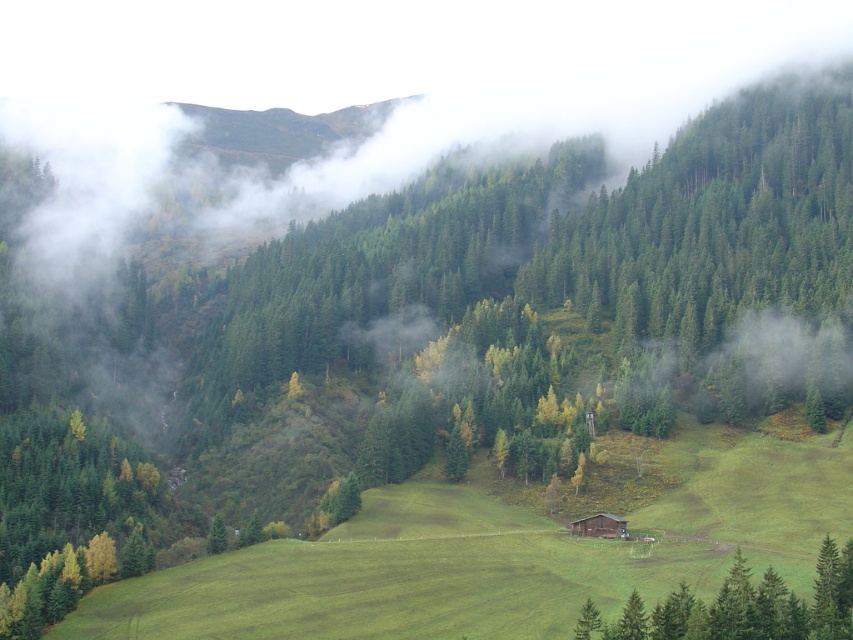
Question: Does green matte tree at lower right appear on the right side of brown wooden cabin at center?

Choices:
 (A) yes
 (B) no

Answer: (A)

Question: Which object appears closest to the camera in this image?

Choices:
 (A) green matte tree at lower right
 (B) brown wooden cabin at center

Answer: (A)

Question: Considering the relative positions of green matte tree at lower right and brown wooden cabin at center in the image provided, where is green matte tree at lower right located with respect to brown wooden cabin at center?

Choices:
 (A) below
 (B) above

Answer: (B)

Question: Among these points, which one is nearest to the camera?

Choices:
 (A) (601, 534)
 (B) (740, 563)

Answer: (B)

Question: Which of the following is the farthest from the observer?

Choices:
 (A) green matte tree at lower right
 (B) brown wooden cabin at center

Answer: (B)

Question: Does green matte tree at lower right have a larger size compared to brown wooden cabin at center?

Choices:
 (A) no
 (B) yes

Answer: (B)